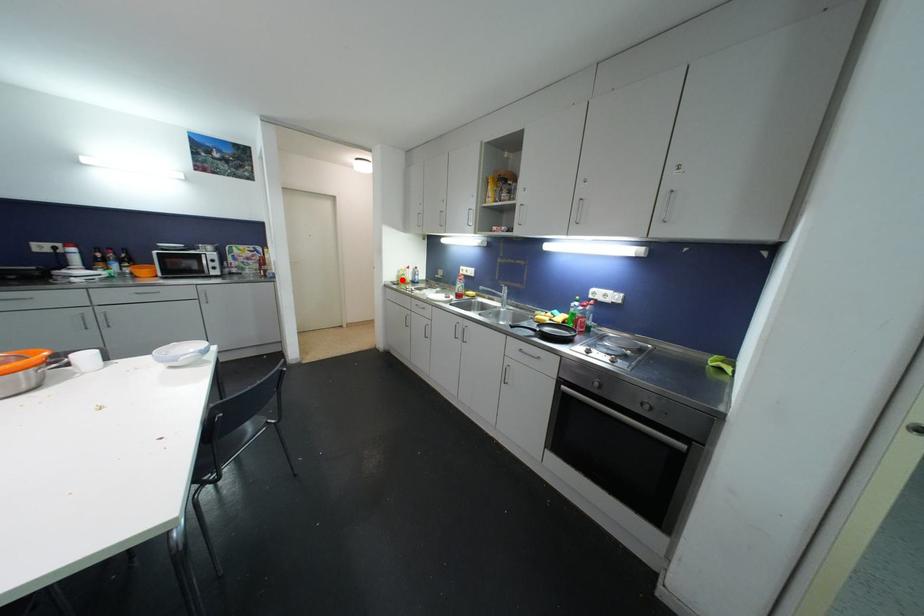
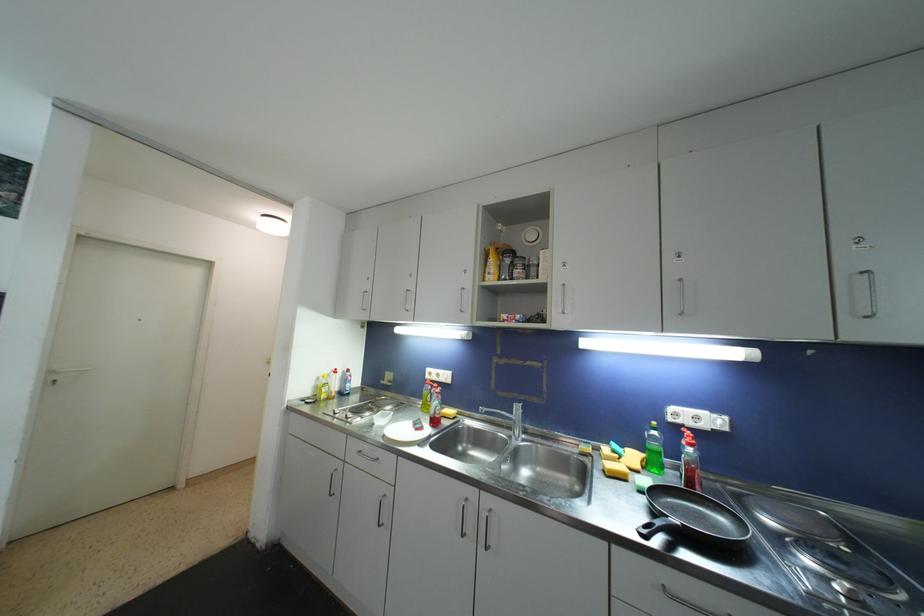
Question: I am providing you with two images of the same scene from different viewpoints. In image1, a red point is highlighted. Considering the same 3D point in image2, which of the following is correct?

Choices:
 (A) It is closer
 (B) It is farther

Answer: (B)